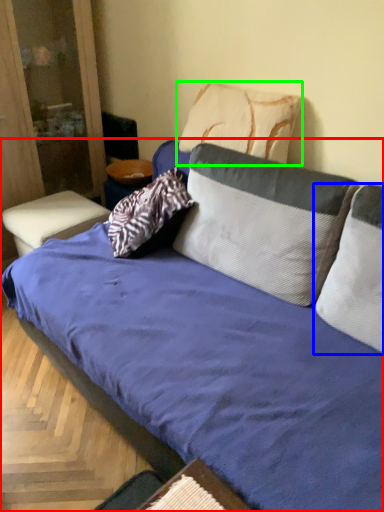
Question: Which is farther away from studio couch (highlighted by a red box)? pillow (highlighted by a blue box) or pillow (highlighted by a green box)?

Choices:
 (A) pillow
 (B) pillow

Answer: (B)